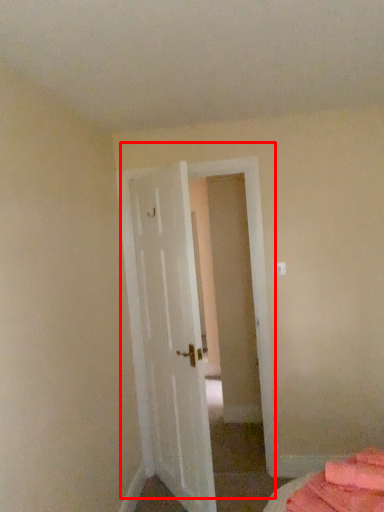
Question: From the image's perspective, where is door (annotated by the red box) located in relation to bed in the image?

Choices:
 (A) above
 (B) below

Answer: (A)